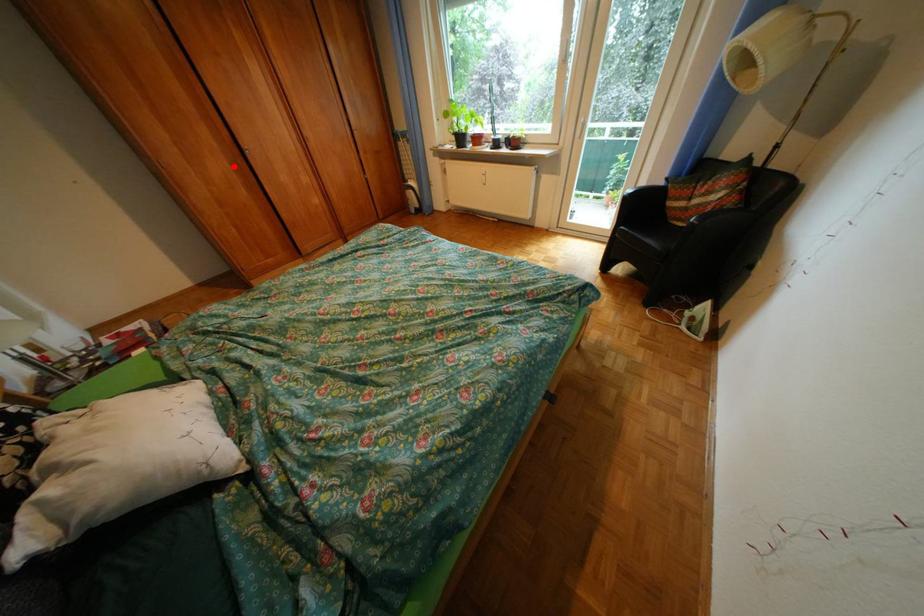
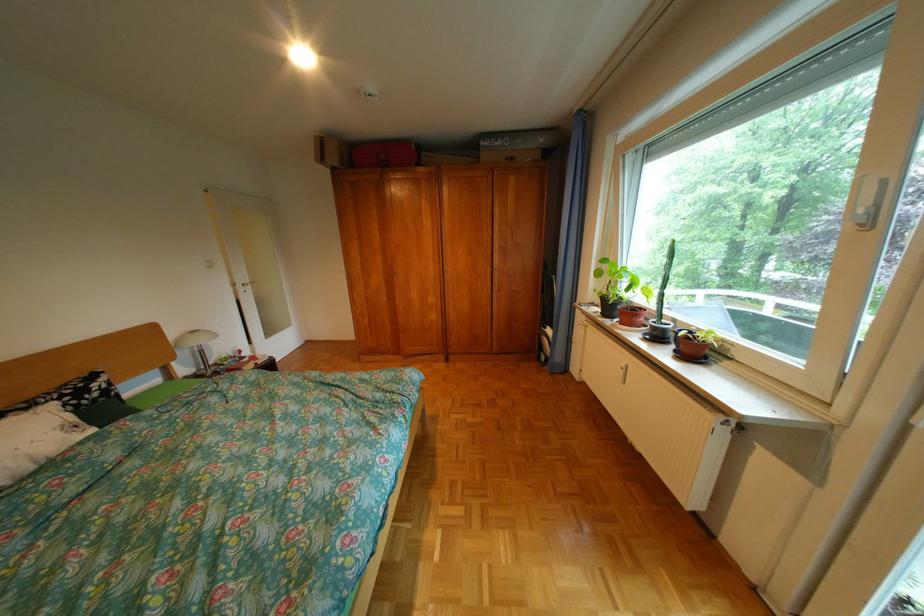
Question: A red point is marked in image1. In image2, is the corresponding 3D point closer to the camera or farther? Reply with the corresponding letter.

Choices:
 (A) The corresponding 3D point is closer.
 (B) The corresponding 3D point is farther.

Answer: (A)